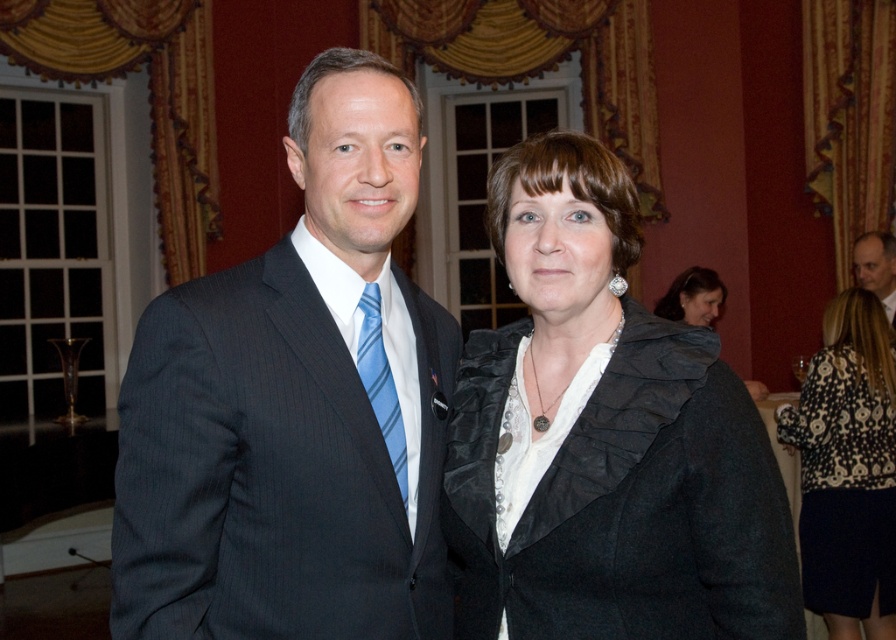
Identify the location of black wool coat at center. This screenshot has width=896, height=640. (604, 440).

Does black wool coat at center lie behind light brown wood table at upper right?

No.

Which is behind, point (511, 424) or point (884, 260)?

Positioned behind is point (884, 260).

The width and height of the screenshot is (896, 640). In order to click on black wool coat at center in this screenshot , I will do `click(604, 440)`.

Which of these two, matte black jacket at center or light brown wood table at upper right, stands taller?

light brown wood table at upper right is taller.

What do you see at coordinates (694, 298) in the screenshot?
I see `matte black jacket at center` at bounding box center [694, 298].

Find the location of a particular element. The width and height of the screenshot is (896, 640). matte black jacket at center is located at coordinates (694, 298).

Can you confirm if matte black suit at center is positioned to the right of matte black jacket at center?

Incorrect, matte black suit at center is not on the right side of matte black jacket at center.

Between matte black suit at center and matte black jacket at center, which one has less height?

matte black jacket at center is shorter.

Does point (195, 339) come behind point (669, 316)?

No, (195, 339) is in front of (669, 316).

Where is `matte black suit at center`? The width and height of the screenshot is (896, 640). matte black suit at center is located at coordinates (294, 408).